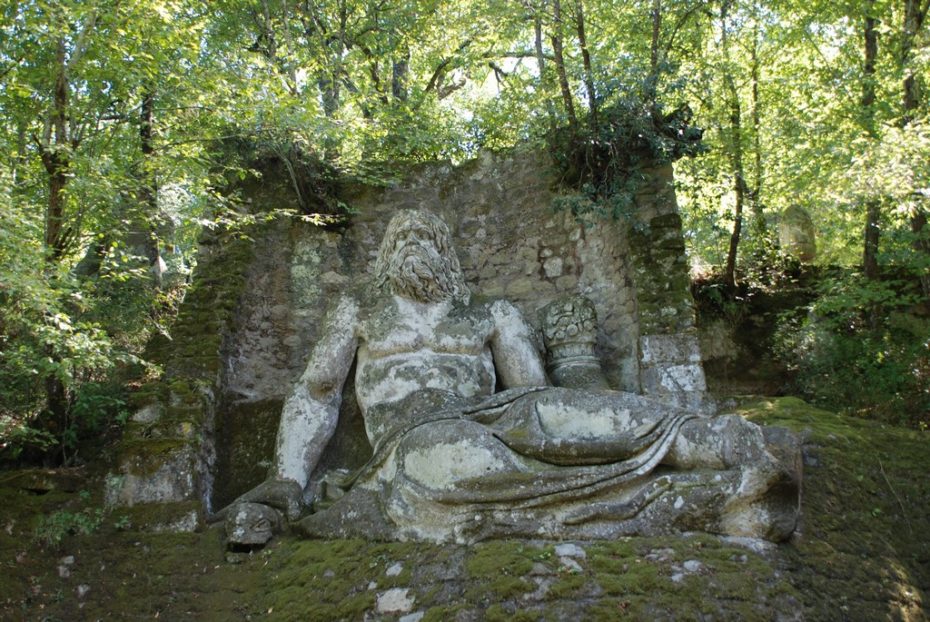
The height and width of the screenshot is (622, 930). In order to click on green plant in this screenshot , I will do tap(628, 565).